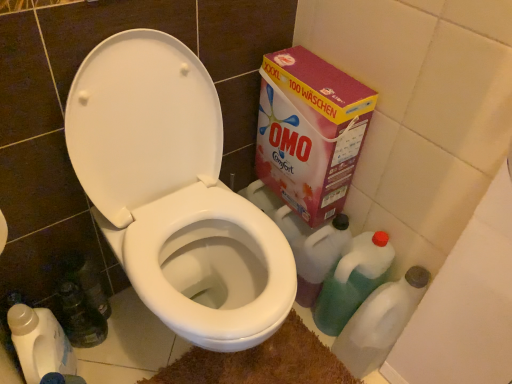
Question: Is translucent plastic bottle at lower right, which is the first cleaning product from right to left, outside of pink cardboard box at upper right?

Choices:
 (A) yes
 (B) no

Answer: (A)

Question: From a real-world perspective, is translucent plastic bottle at lower right, which is the first cleaning product from right to left, physically above pink cardboard box at upper right?

Choices:
 (A) yes
 (B) no

Answer: (B)

Question: Does translucent plastic bottle at lower right, which is the first cleaning product from right to left, contain pink cardboard box at upper right?

Choices:
 (A) no
 (B) yes

Answer: (A)

Question: Is there a large distance between translucent plastic bottle at lower right, which is the first cleaning product from right to left, and pink cardboard box at upper right?

Choices:
 (A) no
 (B) yes

Answer: (A)

Question: Considering the relative sizes of translucent plastic bottle at lower right, which is the 2th cleaning product from left to right, and pink cardboard box at upper right in the image provided, is translucent plastic bottle at lower right, which is the 2th cleaning product from left to right, smaller than pink cardboard box at upper right?

Choices:
 (A) yes
 (B) no

Answer: (A)

Question: From the image's perspective, is brown shaggy bath mat at lower center above or below translucent plastic bottle at lower right, which is the 2th cleaning product from left to right?

Choices:
 (A) above
 (B) below

Answer: (B)

Question: From a real-world perspective, is brown shaggy bath mat at lower center physically located above or below translucent plastic bottle at lower right, which is the 2th cleaning product from left to right?

Choices:
 (A) below
 (B) above

Answer: (A)

Question: Considering the positions of brown shaggy bath mat at lower center and translucent plastic bottle at lower right, which is the 2th cleaning product from left to right, in the image, is brown shaggy bath mat at lower center bigger or smaller than translucent plastic bottle at lower right, which is the 2th cleaning product from left to right,?

Choices:
 (A) small
 (B) big

Answer: (A)

Question: Considering the positions of brown shaggy bath mat at lower center and translucent plastic bottle at lower right, which is the 2th cleaning product from left to right, in the image, is brown shaggy bath mat at lower center wider or thinner than translucent plastic bottle at lower right, which is the 2th cleaning product from left to right,?

Choices:
 (A) thin
 (B) wide

Answer: (B)

Question: In the image, is pink cardboard box at upper right positioned in front of or behind white glossy toilet at center?

Choices:
 (A) front
 (B) behind

Answer: (B)

Question: In the image, is pink cardboard box at upper right on the left side or the right side of white glossy toilet at center?

Choices:
 (A) right
 (B) left

Answer: (A)

Question: Do you think pink cardboard box at upper right is within white glossy toilet at center, or outside of it?

Choices:
 (A) outside
 (B) inside

Answer: (A)

Question: From their relative heights in the image, would you say pink cardboard box at upper right is taller or shorter than white glossy toilet at center?

Choices:
 (A) tall
 (B) short

Answer: (B)

Question: In the image, is pink cardboard box at upper right on the left side or the right side of brown shaggy bath mat at lower center?

Choices:
 (A) left
 (B) right

Answer: (B)

Question: Relative to brown shaggy bath mat at lower center, is pink cardboard box at upper right in front or behind?

Choices:
 (A) behind
 (B) front

Answer: (B)